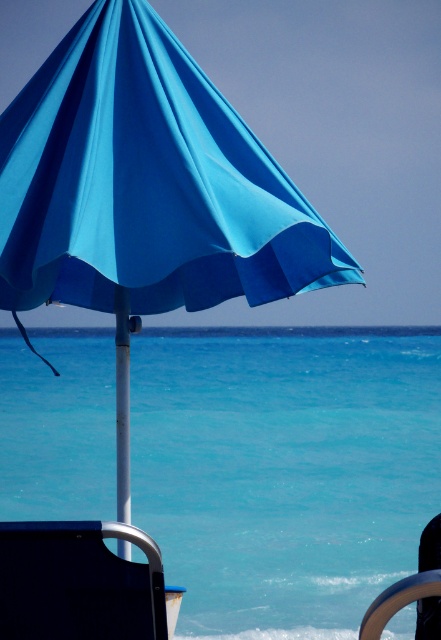
You are a beachgoer who wants to place your metallic silver ring at lower right on the sand near the turquoise water at center. Based on the scene, will the ring be fully visible above the water level?

The turquoise water at center is much taller than the metallic silver ring at lower right, so the ring will be submerged by the water and not fully visible above the water level.

You are a photographer setting up a shot of the beach scene. You need to ensure the blue fabric umbrella at upper center and the metallic silver ring at lower right are both in frame. Given their relative sizes, which object will appear larger in your photo?

The blue fabric umbrella at upper center is taller than the metallic silver ring at lower right, so it will appear larger in the photo.